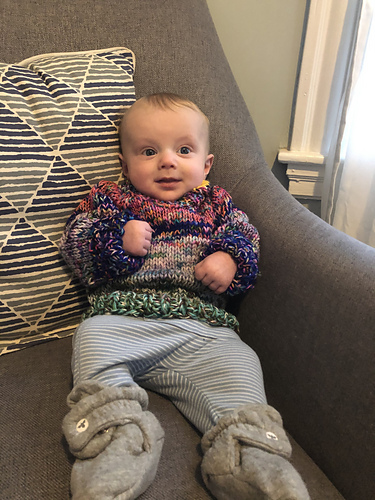
Find the location of `white curtain`. white curtain is located at coordinates (345, 210).